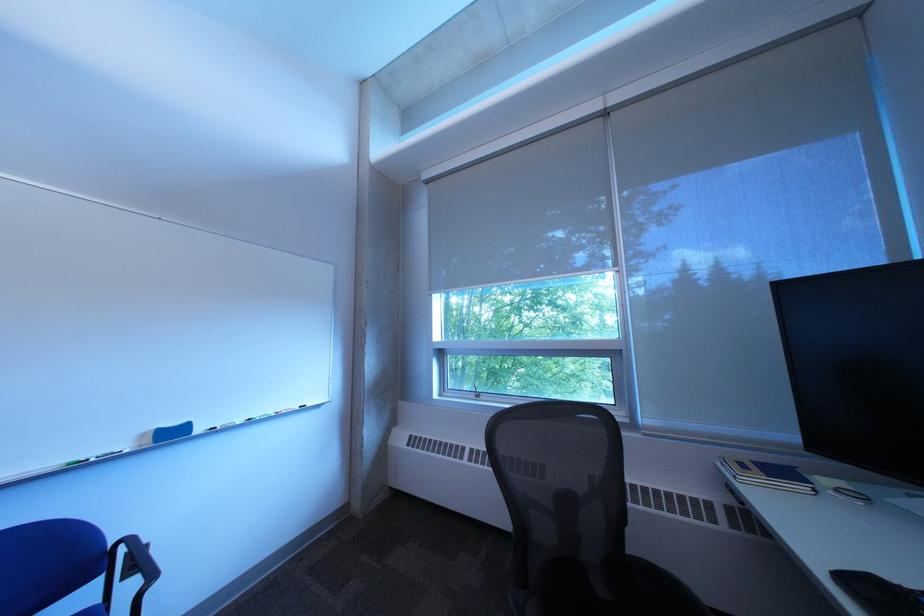
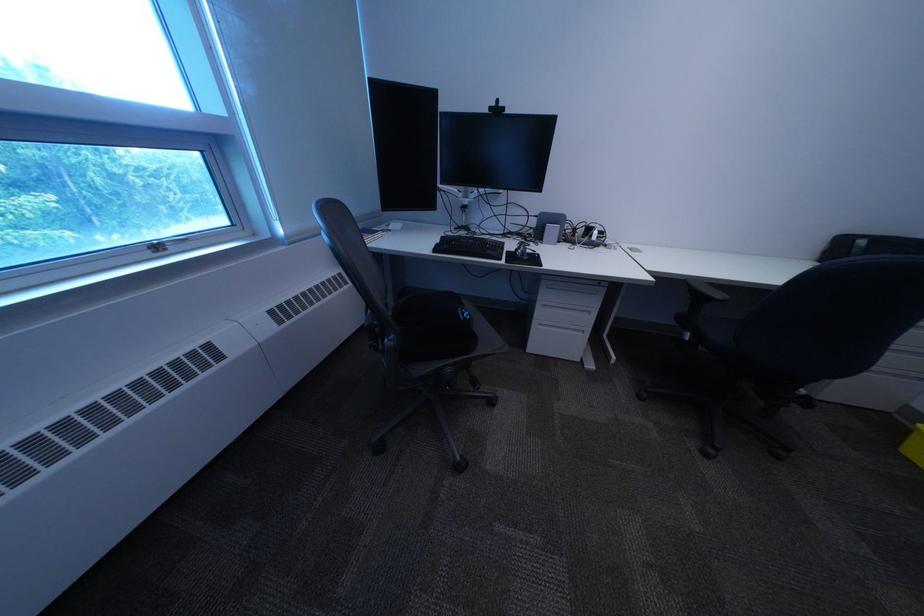
In the second image, find the point that corresponds to point (860, 582) in the first image.

(451, 252)